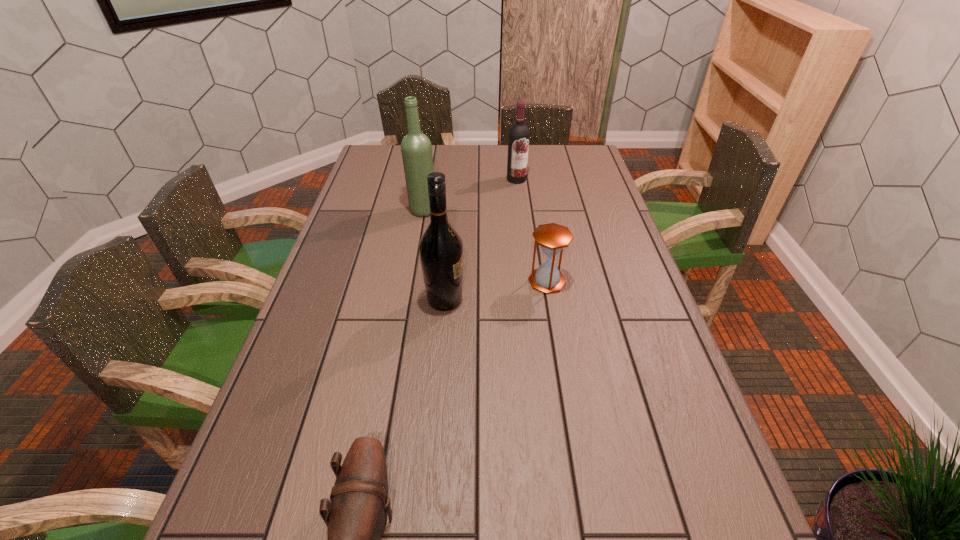
The height and width of the screenshot is (540, 960). In the image, there is a desktop. Identify the location of vacant area at the left edge. (240, 494).

This screenshot has height=540, width=960. What are the coordinates of `vacant region at the right edge of the desktop` in the screenshot? It's located at (630, 260).

Where is `free space at the far left corner`? This screenshot has width=960, height=540. free space at the far left corner is located at coordinates (389, 156).

In the image, there is a desktop. Identify the location of vacant space at the far right corner. This screenshot has width=960, height=540. (570, 151).

The width and height of the screenshot is (960, 540). I want to click on vacant area between the second nearest wine bottle and the hourglass, so click(x=485, y=246).

The width and height of the screenshot is (960, 540). What are the coordinates of `vacant area that lies between the farthest object and the hourglass` in the screenshot? It's located at (532, 230).

Where is `vacant area that lies between the shortest wine bottle and the nearest wine bottle`? The image size is (960, 540). vacant area that lies between the shortest wine bottle and the nearest wine bottle is located at coordinates (481, 240).

Where is `vacant area that lies between the nearest wine bottle and the farthest object`? vacant area that lies between the nearest wine bottle and the farthest object is located at coordinates (481, 240).

Image resolution: width=960 pixels, height=540 pixels. Identify the location of vacant area that lies between the nearest wine bottle and the farthest object. (481, 240).

You are a GUI agent. You are given a task and a screenshot of the screen. Output one action in this format:
    pyautogui.click(x=<x>, y=<y>)
    Task: Click on the free space between the second nearest wine bottle and the hourglass
    This screenshot has width=960, height=540.
    Given the screenshot: What is the action you would take?
    pyautogui.click(x=485, y=246)